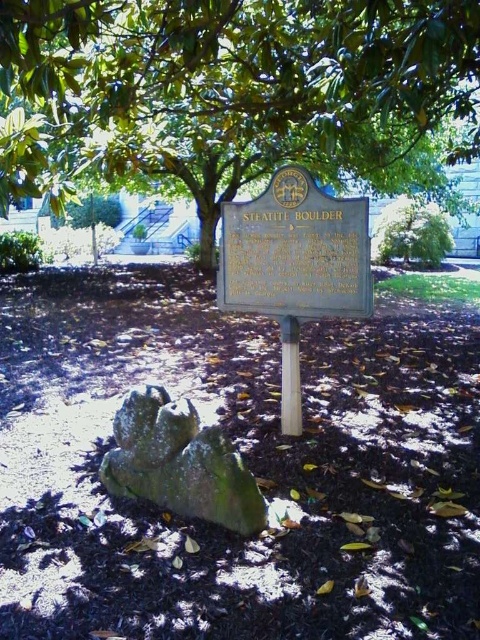
Who is more forward, (169, 80) or (316, 243)?

Point (316, 243)

Does green leafy tree at upper center have a greater width compared to gold plaque at center?

Indeed, green leafy tree at upper center has a greater width compared to gold plaque at center.

Where is `green leafy tree at upper center`? This screenshot has width=480, height=640. green leafy tree at upper center is located at coordinates (235, 96).

Is green leafy tree at upper center positioned in front of green mossy rock at center?

That is True.

Is point (145, 115) positioned behind point (192, 412)?

Yes, it is behind point (192, 412).

Where is `green leafy tree at upper center`? Image resolution: width=480 pixels, height=640 pixels. green leafy tree at upper center is located at coordinates (235, 96).

Is gold plaque at center to the left of green mossy rock at center from the viewer's perspective?

Incorrect, gold plaque at center is not on the left side of green mossy rock at center.

Which is in front, point (340, 310) or point (156, 392)?

Point (156, 392) is more forward.

Where is `gold plaque at center`? gold plaque at center is located at coordinates (295, 252).